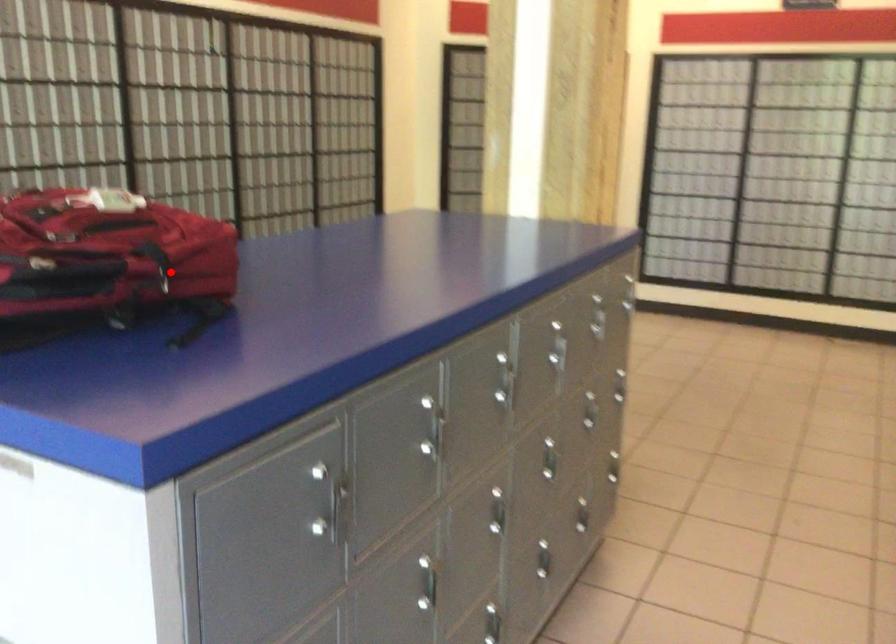
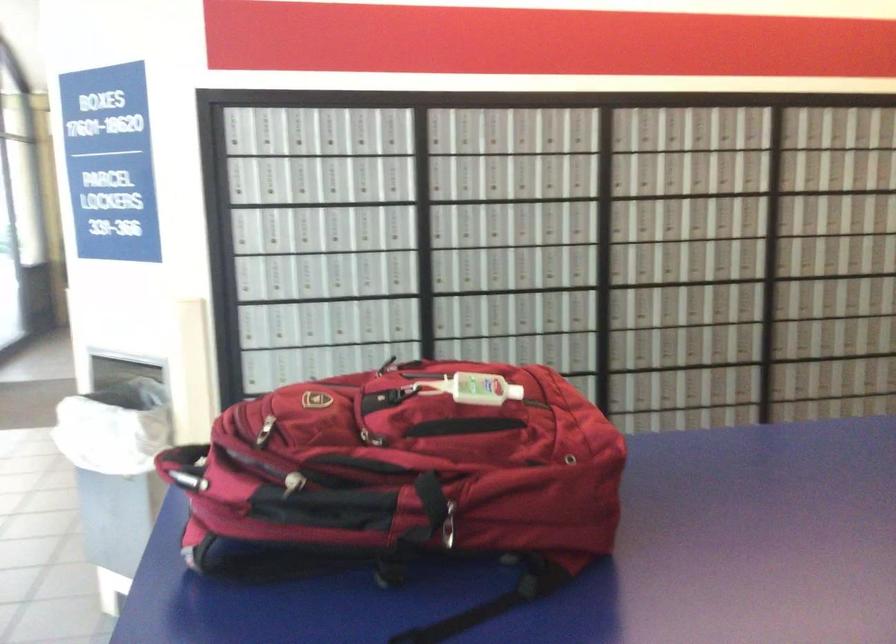
In the second image, find the point that corresponds to the highlighted location in the first image.

(446, 524)